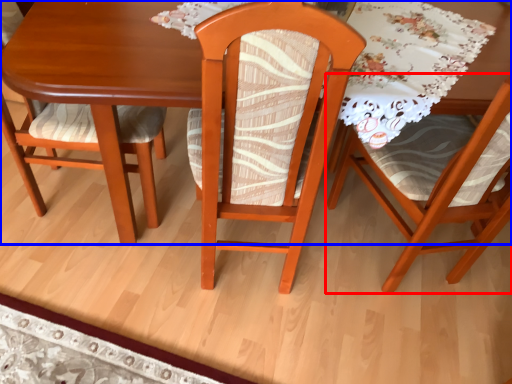
Question: Which object is further to the camera taking this photo, chair (highlighted by a red box) or table (highlighted by a blue box)?

Choices:
 (A) chair
 (B) table

Answer: (B)